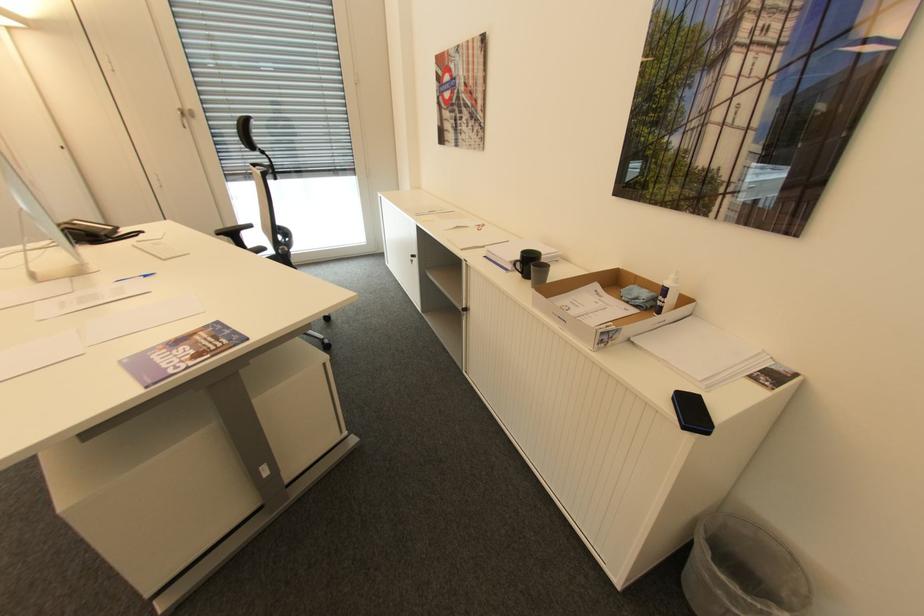
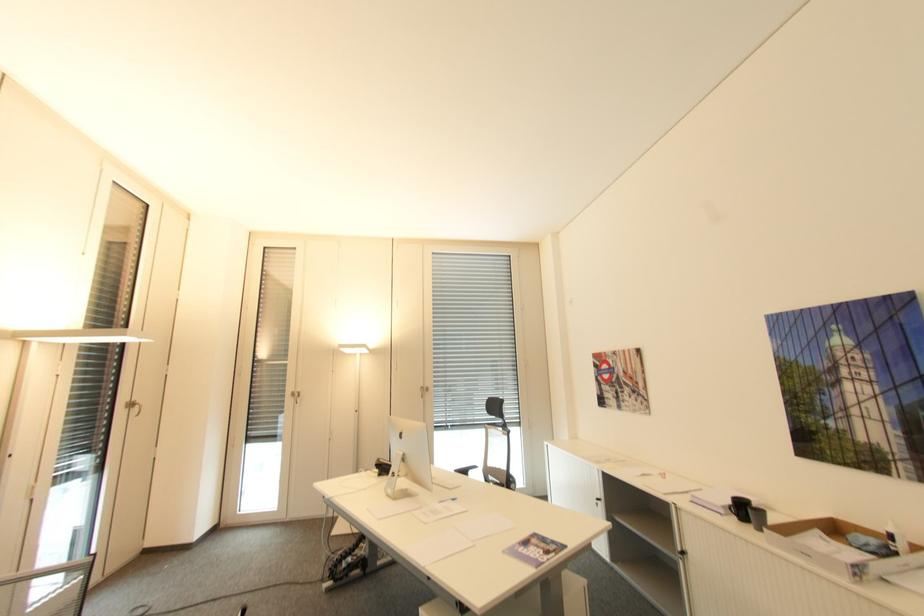
Where in the second image is the point corresponding to point (125, 361) from the first image?

(507, 553)